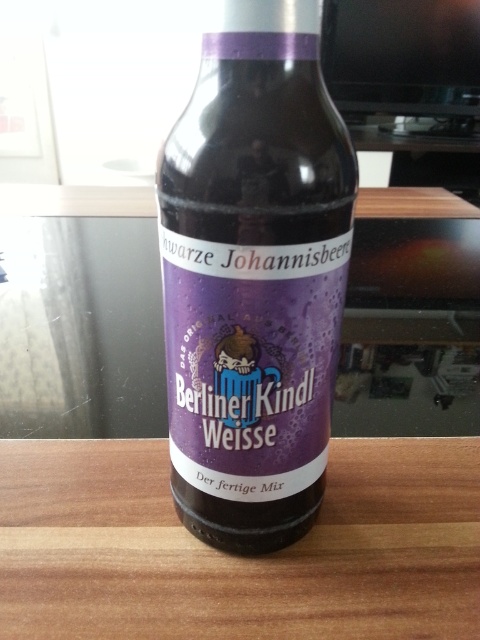
Who is higher up, matte glass bottle at center or wooden table at center?

matte glass bottle at center is higher up.

Who is more forward, (273, 19) or (39, 573)?

Point (273, 19) is in front.

Who is more forward, (192, 228) or (219, 589)?

Point (192, 228) is more forward.

At what (x,y) coordinates should I click in order to perform the action: click on matte glass bottle at center. Please return your answer as a coordinate pair (x, y). Looking at the image, I should click on (253, 276).